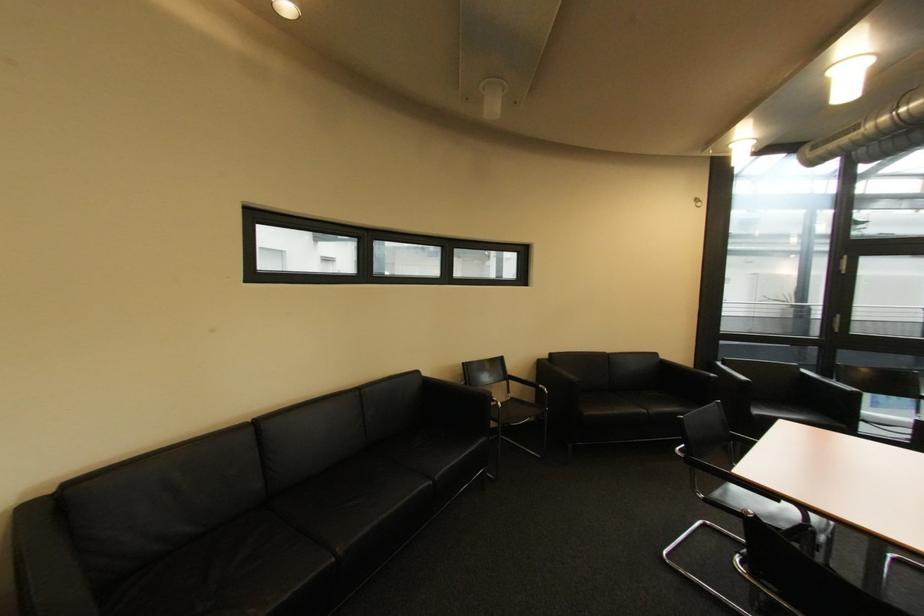
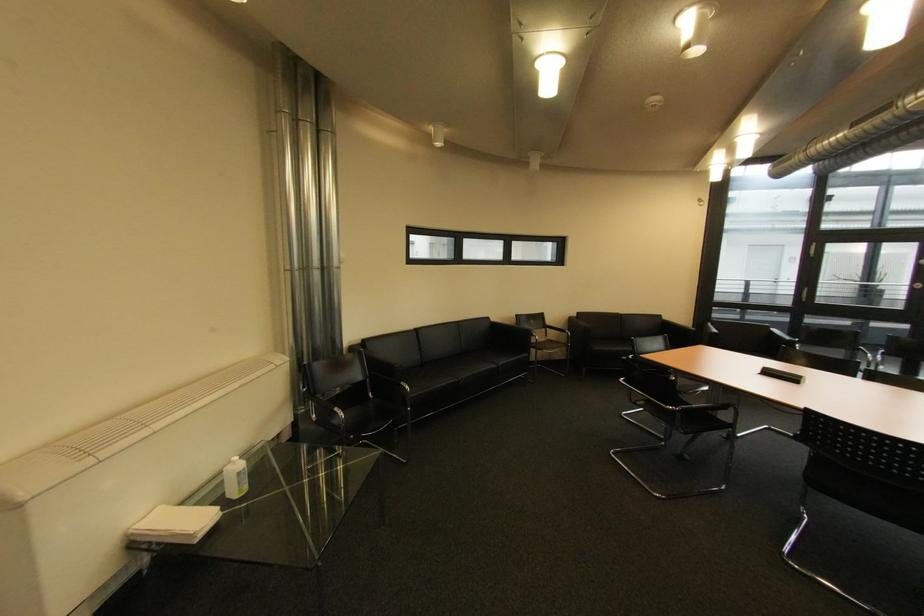
The point at [730,370] is marked in the first image. Where is the corresponding point in the second image?

(716, 329)